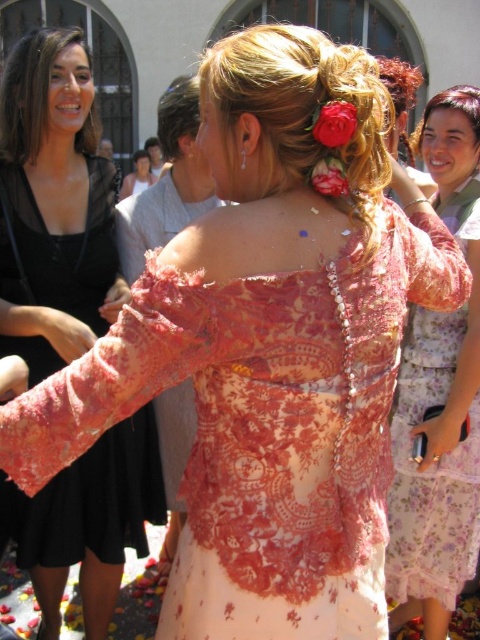
Question: Which point is farther to the camera?

Choices:
 (A) dark brown hair at upper center
 (B) pink fabric flower at upper center
 (C) blonde silky hair at upper right

Answer: (A)

Question: Is dark brown silky hair at upper left in front of pink fabric flower at upper center?

Choices:
 (A) yes
 (B) no

Answer: (B)

Question: From the image, what is the correct spatial relationship of blonde lace braid at upper center in relation to pink fabric flower at upper center?

Choices:
 (A) below
 (B) above

Answer: (B)

Question: Does dark brown silky hair at upper left appear on the left side of pink fabric flower at upper center?

Choices:
 (A) no
 (B) yes

Answer: (B)

Question: Which point is closer to the camera taking this photo?

Choices:
 (A) (2, 76)
 (B) (337, 145)
 (C) (456, 97)

Answer: (B)

Question: Which of the following is the closest to the observer?

Choices:
 (A) silky red flower at upper center
 (B) matte lace dress at upper left
 (C) blonde lace braid at upper center
 (D) dark brown silky hair at upper left

Answer: (A)